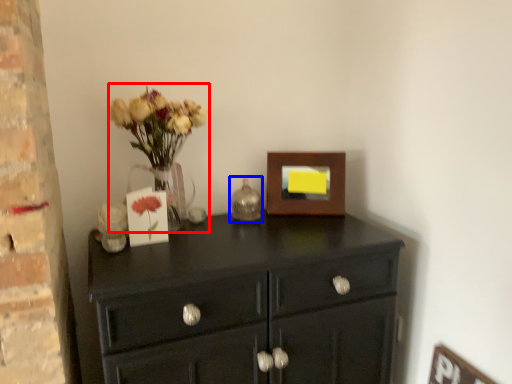
Question: Which object appears closest to the camera in this image, floral arrangement (highlighted by a red box) or candle holder (highlighted by a blue box)?

Choices:
 (A) floral arrangement
 (B) candle holder

Answer: (A)